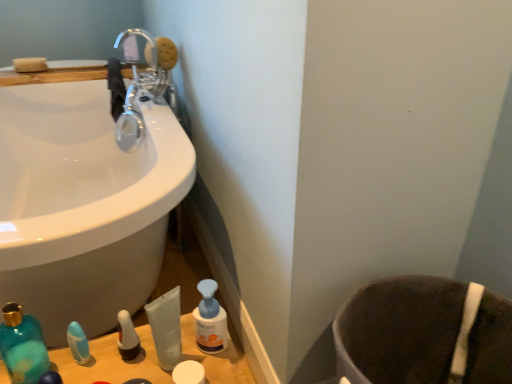
Find the location of `vacant area that lies between translucent plastic tube at lower center, the 3th toiletry viewed from the left, and teal glass mouthwash at lower left`. vacant area that lies between translucent plastic tube at lower center, the 3th toiletry viewed from the left, and teal glass mouthwash at lower left is located at coordinates (106, 362).